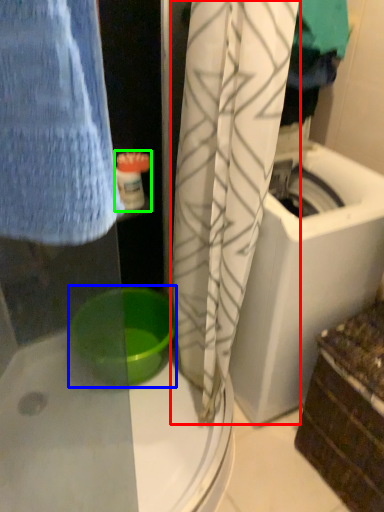
Question: Which is nearer to the curtain (highlighted by a red box)? basin (highlighted by a blue box) or toiletry (highlighted by a green box).

Choices:
 (A) basin
 (B) toiletry

Answer: (A)